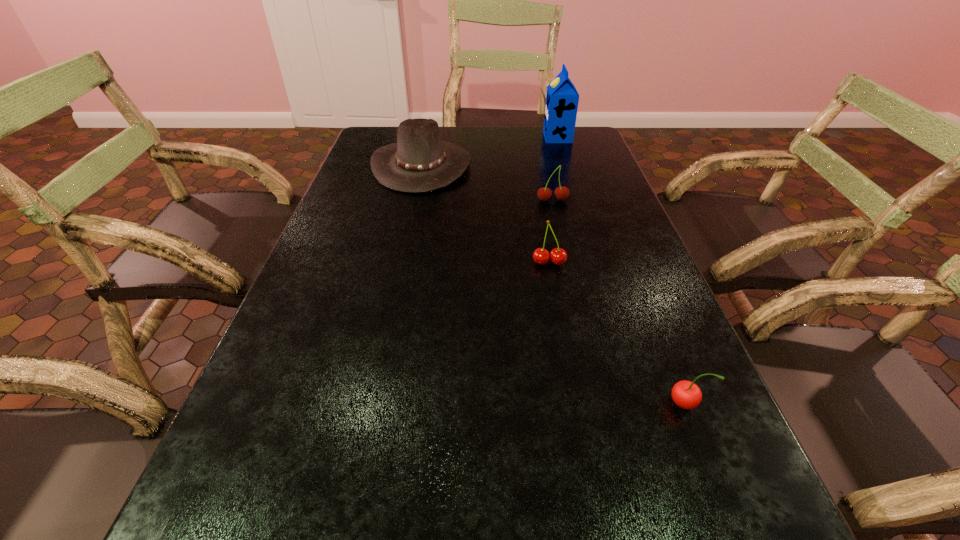
Identify the location of empty space that is in between the nearest cherry and the fourth farthest object. (616, 333).

Where is `empty location between the fourth farthest object and the tallest object`? empty location between the fourth farthest object and the tallest object is located at coordinates (553, 200).

Find the location of a particular element. the second closest object to the farthest cherry is located at coordinates (558, 256).

Identify which object is located as the fourth nearest to the leftmost object. Please provide its 2D coordinates. Your answer should be formatted as a tuple, i.e. [(x, y)], where the tuple contains the x and y coordinates of a point satisfying the conditions above.

[(686, 394)]

Choose which cherry is the second nearest neighbor to the second farthest cherry. Please provide its 2D coordinates. Your answer should be formatted as a tuple, i.e. [(x, y)], where the tuple contains the x and y coordinates of a point satisfying the conditions above.

[(686, 394)]

Select which cherry is the third closest to the carton. Please provide its 2D coordinates. Your answer should be formatted as a tuple, i.e. [(x, y)], where the tuple contains the x and y coordinates of a point satisfying the conditions above.

[(686, 394)]

Find the location of a particular element. Image resolution: width=960 pixels, height=540 pixels. vacant region that satisfies the following two spatial constraints: 1. on the front-facing side of the leftmost object; 2. on the left side of the nearest cherry is located at coordinates (371, 403).

Where is `vacant region that satisfies the following two spatial constraints: 1. with the cap open on the tallest object; 2. on the surface of the farthest cherry`? The image size is (960, 540). vacant region that satisfies the following two spatial constraints: 1. with the cap open on the tallest object; 2. on the surface of the farthest cherry is located at coordinates (578, 201).

Locate an element on the screen. blank area in the image that satisfies the following two spatial constraints: 1. with the cap open on the nearest object; 2. on the right side of the tallest object is located at coordinates (641, 403).

Identify the location of free space that satisfies the following two spatial constraints: 1. with the stems of the fourth farthest object pointing upwards; 2. on the left side of the rightmost cherry. Image resolution: width=960 pixels, height=540 pixels. (575, 403).